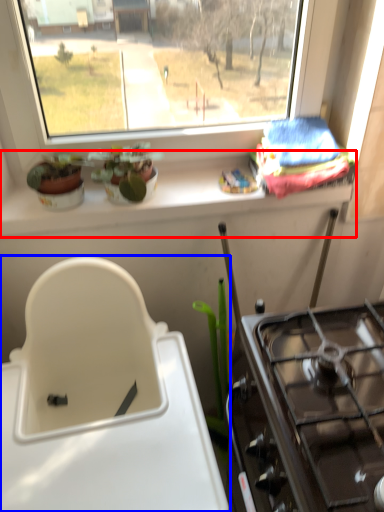
Question: Which object appears closest to the camera in this image, window sill (highlighted by a red box) or sink (highlighted by a blue box)?

Choices:
 (A) window sill
 (B) sink

Answer: (B)